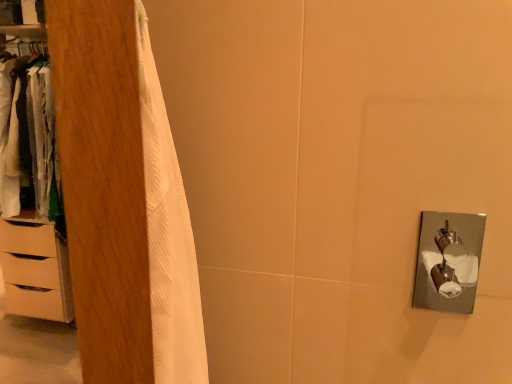
In order to face white wood dresser at left, should I rotate leftwards or rightwards?

It's best to rotate left around 28.571 degrees.

Locate an element on the screen. white wood dresser at left is located at coordinates (32, 197).

Is white matte chest of drawers at left not within wooden wardrobe at left?

Yes.

Considering the positions of points (8, 232) and (105, 154), is point (8, 232) farther from camera compared to point (105, 154)?

Yes, point (8, 232) is behind point (105, 154).

From a real-world perspective, is white matte chest of drawers at left above or below wooden wardrobe at left?

From a real-world perspective, white matte chest of drawers at left is physically below wooden wardrobe at left.

Could you tell me if white matte chest of drawers at left is facing wooden wardrobe at left?

No, white matte chest of drawers at left is not turned towards wooden wardrobe at left.

Considering the relative sizes of white wood dresser at left and wooden wardrobe at left in the image provided, is white wood dresser at left shorter than wooden wardrobe at left?

Incorrect, the height of white wood dresser at left does not fall short of that of wooden wardrobe at left.

Can you see white wood dresser at left touching wooden wardrobe at left?

white wood dresser at left and wooden wardrobe at left are clearly separated.

This screenshot has height=384, width=512. I want to click on armoire on the right of white wood dresser at left, so click(x=103, y=184).

From a real-world perspective, relative to wooden wardrobe at left, is white wood dresser at left vertically above or below?

In terms of real-world spatial position, white wood dresser at left is below wooden wardrobe at left.

Is the depth of white matte chest of drawers at left less than that of white wood dresser at left?

No, the depth of white matte chest of drawers at left is greater than that of white wood dresser at left.

From the image's perspective, which object appears higher, white matte chest of drawers at left or white wood dresser at left?

white wood dresser at left, from the image's perspective.

Identify the location of dresser in front of the white matte chest of drawers at left. This screenshot has height=384, width=512. (32, 197).

Based on their sizes in the image, would you say white matte chest of drawers at left is bigger or smaller than white wood dresser at left?

white matte chest of drawers at left is smaller than white wood dresser at left.

Which object is more forward, wooden wardrobe at left or white wood dresser at left?

wooden wardrobe at left.

Is wooden wardrobe at left directly adjacent to white wood dresser at left?

They are not placed beside each other.

From the image's perspective, is wooden wardrobe at left on top of white wood dresser at left?

No.

Which of these two, wooden wardrobe at left or white wood dresser at left, stands taller?

Standing taller between the two is white wood dresser at left.

Is there a large distance between white wood dresser at left and white matte chest of drawers at left?

No, there isn't a large distance between white wood dresser at left and white matte chest of drawers at left.

From the image's perspective, which is above, white wood dresser at left or white matte chest of drawers at left?

white wood dresser at left, from the image's perspective.

Between white wood dresser at left and white matte chest of drawers at left, which one has less height?

white matte chest of drawers at left.

Could you tell me if white wood dresser at left is facing white matte chest of drawers at left?

No.

Does wooden wardrobe at left come in front of white matte chest of drawers at left?

Yes, it is.

Who is bigger, wooden wardrobe at left or white matte chest of drawers at left?

With larger size is white matte chest of drawers at left.

Considering the positions of objects wooden wardrobe at left and white matte chest of drawers at left in the image provided, who is more to the right, wooden wardrobe at left or white matte chest of drawers at left?

Positioned to the right is wooden wardrobe at left.

Locate an element on the screen. chest of drawers on the left of wooden wardrobe at left is located at coordinates (35, 271).

At what (x,y) coordinates should I click in order to perform the action: click on dresser above the wooden wardrobe at left (from the image's perspective). Please return your answer as a coordinate pair (x, y). The width and height of the screenshot is (512, 384). Looking at the image, I should click on (32, 197).

From the image, which object appears to be farther from white matte chest of drawers at left, white wood dresser at left or wooden wardrobe at left?

Result: The object further to white matte chest of drawers at left is wooden wardrobe at left.

From the image, which object appears to be nearer to white matte chest of drawers at left, wooden wardrobe at left or white wood dresser at left?

white wood dresser at left.

Which object lies nearer to the anchor point white wood dresser at left, wooden wardrobe at left or white matte chest of drawers at left?

Result: Based on the image, white matte chest of drawers at left appears to be nearer to white wood dresser at left.

Estimate the real-world distances between objects in this image. Which object is closer to wooden wardrobe at left, white wood dresser at left or white matte chest of drawers at left?

white wood dresser at left is closer to wooden wardrobe at left.

Which object lies further to the anchor point wooden wardrobe at left, white matte chest of drawers at left or white wood dresser at left?

Among the two, white matte chest of drawers at left is located further to wooden wardrobe at left.

From the image, which object appears to be farther from white wood dresser at left, white matte chest of drawers at left or wooden wardrobe at left?

The object further to white wood dresser at left is wooden wardrobe at left.

The height and width of the screenshot is (384, 512). What are the coordinates of `dresser between wooden wardrobe at left and white matte chest of drawers at left in the front-back direction` in the screenshot? It's located at (32, 197).